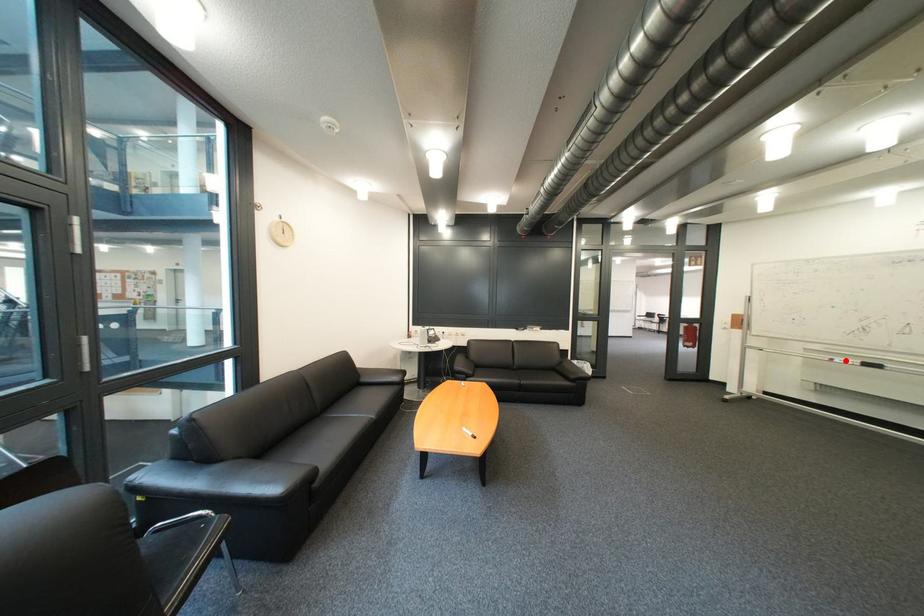
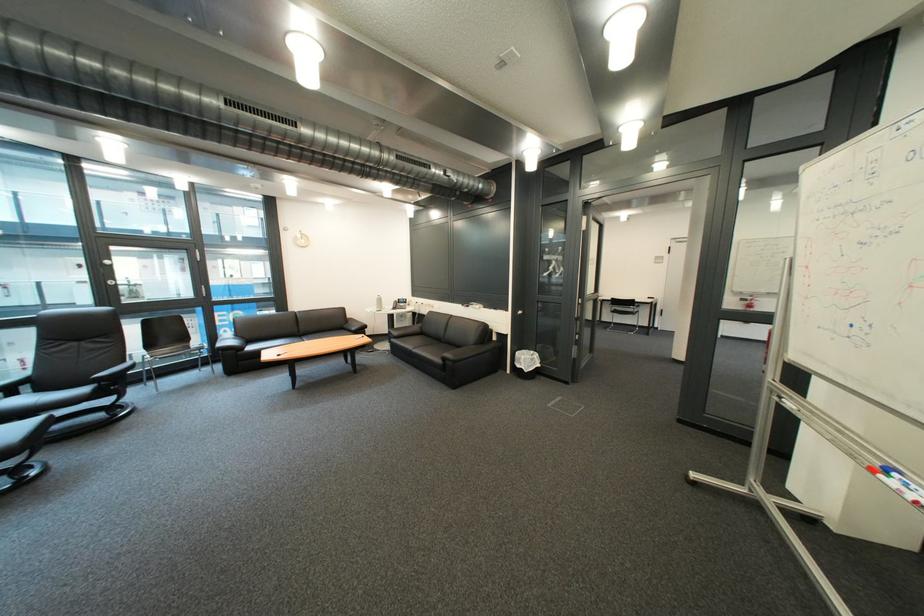
Where in the second image is the point corresponding to the highlighted location from the first image?

(901, 472)